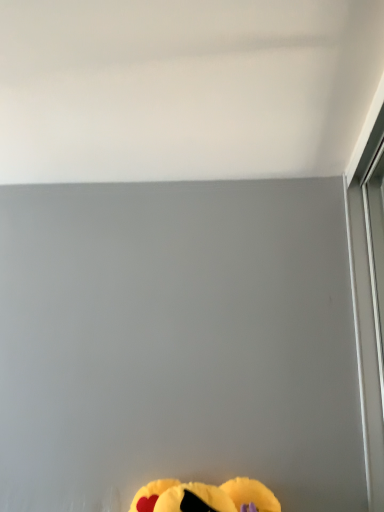
Image resolution: width=384 pixels, height=512 pixels. I want to click on yellow plush toy at lower center, so click(x=205, y=497).

Image resolution: width=384 pixels, height=512 pixels. Describe the element at coordinates (205, 497) in the screenshot. I see `yellow plush toy at lower center` at that location.

In order to click on yellow plush toy at lower center in this screenshot , I will do `click(205, 497)`.